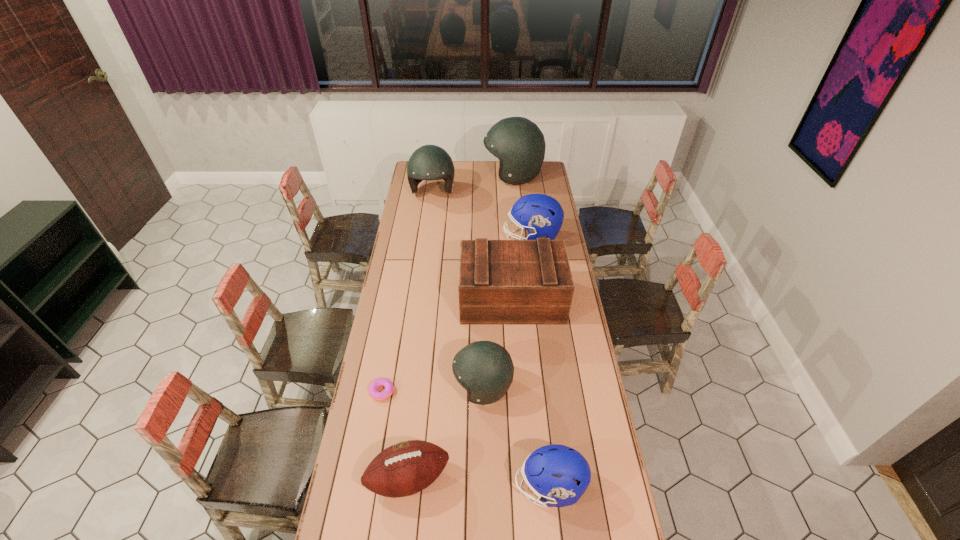
Image resolution: width=960 pixels, height=540 pixels. I want to click on vacant space situated 0.130m on the front-facing side of the third farthest object, so click(x=478, y=238).

Find the location of a particular element. This screenshot has height=540, width=960. free space located 0.080m on the front-facing side of the third farthest object is located at coordinates (488, 238).

Where is `vacant space located 0.260m on the front of the box`? This screenshot has width=960, height=540. vacant space located 0.260m on the front of the box is located at coordinates (517, 376).

Locate an element on the screen. vacant space located at the face opening of the nearest green football helmet is located at coordinates (377, 386).

In order to click on vacant position located at the face opening of the nearest green football helmet in this screenshot , I will do `click(364, 386)`.

Where is `free space located 0.130m at the face opening of the nearest green football helmet`? This screenshot has height=540, width=960. free space located 0.130m at the face opening of the nearest green football helmet is located at coordinates (420, 386).

This screenshot has height=540, width=960. I want to click on free region located on the front-facing side of the nearest football helmet, so click(468, 487).

Find the location of a particular element. blank space located 0.100m on the front-facing side of the nearest football helmet is located at coordinates (483, 487).

You are a GUI agent. You are given a task and a screenshot of the screen. Output one action in this format:
    pyautogui.click(x=<x>, y=<y>)
    Task: Click on the vacant space situated on the front-facing side of the nearest football helmet
    
    Given the screenshot: What is the action you would take?
    pyautogui.click(x=393, y=487)

Find the location of a particular element. blank space located 0.290m on the back of the brown football (American) is located at coordinates (420, 380).